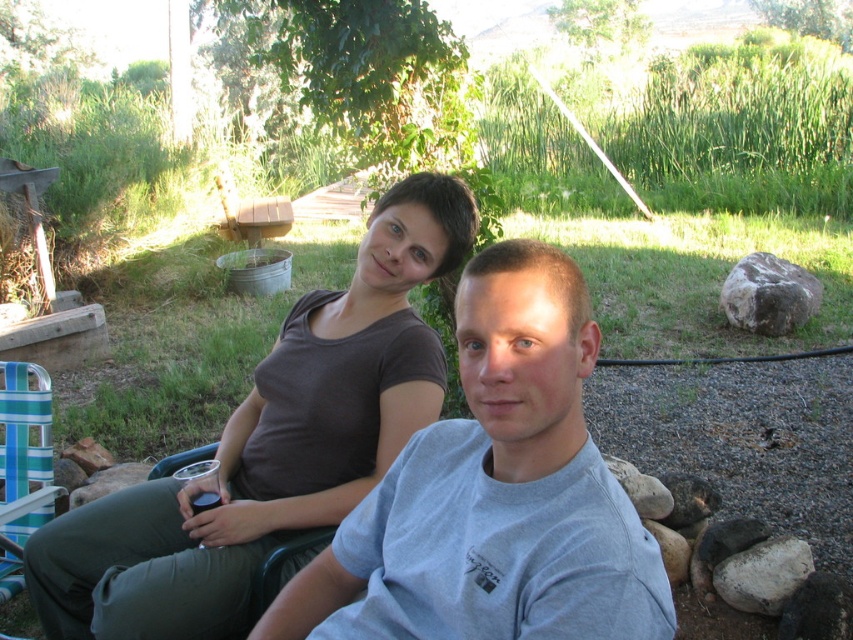
Is gray cotton t-shirt at center wider than teal striped plastic chair at lower left?

Correct, the width of gray cotton t-shirt at center exceeds that of teal striped plastic chair at lower left.

In the scene shown: Does gray cotton t-shirt at center have a greater height compared to teal striped plastic chair at lower left?

No.

Find the location of a particular element. The width and height of the screenshot is (853, 640). gray cotton t-shirt at center is located at coordinates (494, 493).

Is teal striped plastic chair at lower left behind green plastic chair at lower left?

That is True.

Which is above, teal striped plastic chair at lower left or green plastic chair at lower left?

green plastic chair at lower left

Which is behind, point (13, 534) or point (271, 579)?

Point (13, 534)

The height and width of the screenshot is (640, 853). I want to click on teal striped plastic chair at lower left, so click(x=22, y=467).

Who is taller, matte brown shirt at upper center or teal striped plastic chair at lower left?

With more height is matte brown shirt at upper center.

Is matte brown shirt at upper center to the right of teal striped plastic chair at lower left from the viewer's perspective?

Correct, you'll find matte brown shirt at upper center to the right of teal striped plastic chair at lower left.

Identify the location of matte brown shirt at upper center. (271, 444).

Find the location of a particular element. matte brown shirt at upper center is located at coordinates (271, 444).